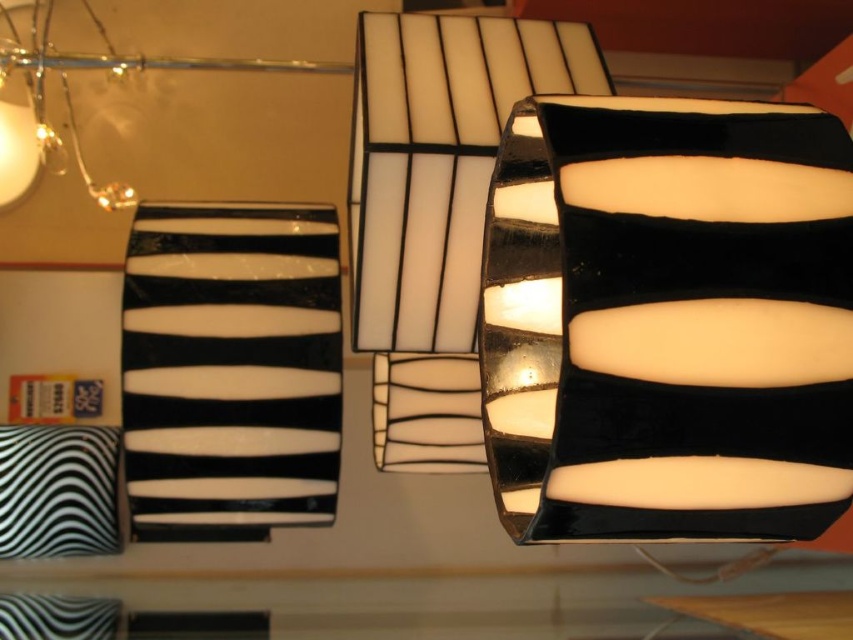
Question: Does black glossy lampshade at center have a lesser width compared to translucent glass lampshade at upper center?

Choices:
 (A) yes
 (B) no

Answer: (A)

Question: Which object is the closest to the black glossy lampshade at center?

Choices:
 (A) black glossy lampshade at left
 (B) zebra-patterned fabric pillow at lower left
 (C) translucent glass lampshade at upper center

Answer: (C)

Question: Which of the following is the farthest from the observer?

Choices:
 (A) black glossy lampshade at left
 (B) zebra-patterned fabric pillow at lower left
 (C) black glossy lampshade at center

Answer: (B)

Question: Estimate the real-world distances between objects in this image. Which object is farther from the black glossy lampshade at left?

Choices:
 (A) translucent glass lampshade at upper center
 (B) black glossy lampshade at center

Answer: (B)

Question: Can you confirm if black glossy lampshade at left is smaller than zebra-patterned fabric pillow at lower left?

Choices:
 (A) yes
 (B) no

Answer: (B)

Question: Does black glossy lampshade at center have a lesser width compared to zebra-patterned fabric pillow at lower left?

Choices:
 (A) yes
 (B) no

Answer: (B)